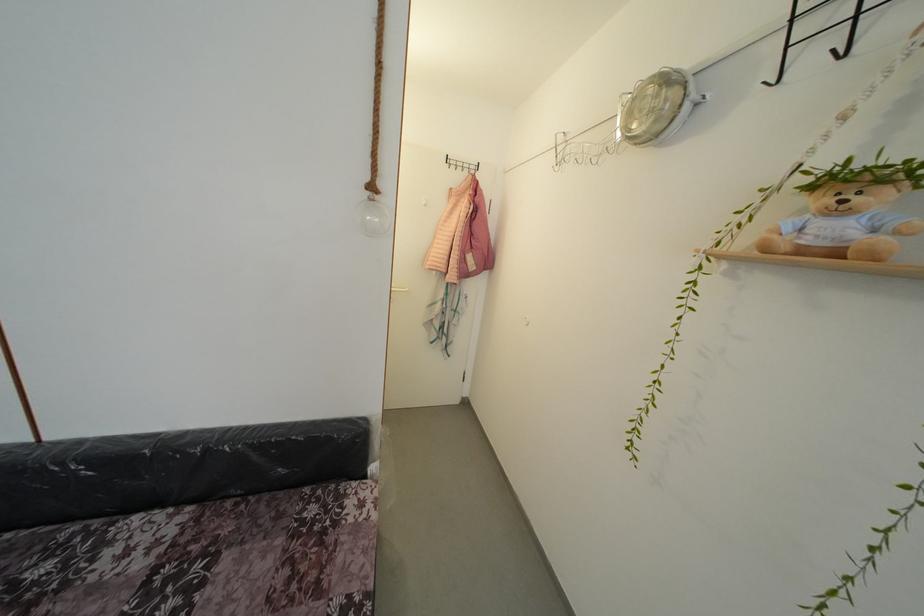
What do you see at coordinates (460, 164) in the screenshot? The height and width of the screenshot is (616, 924). I see `the metal wall hook` at bounding box center [460, 164].